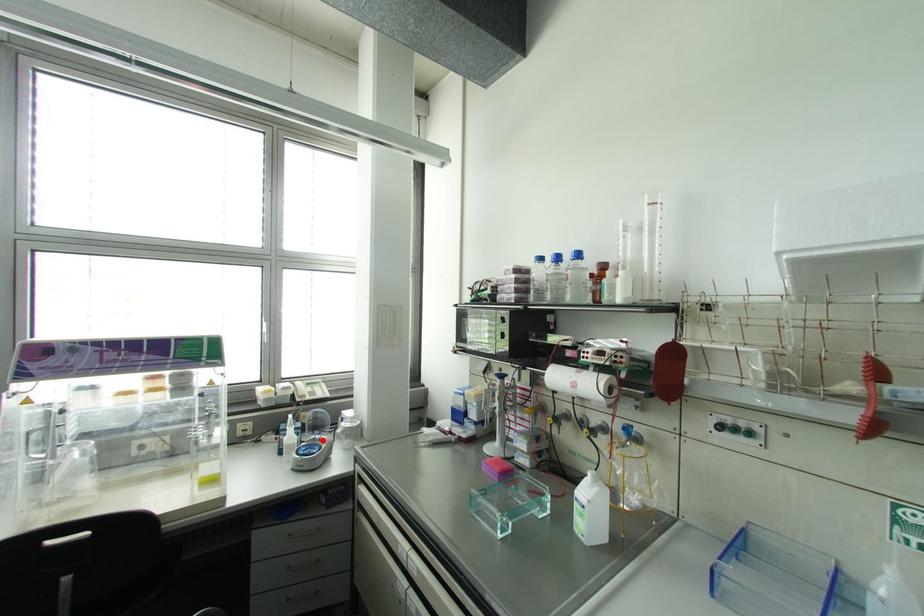
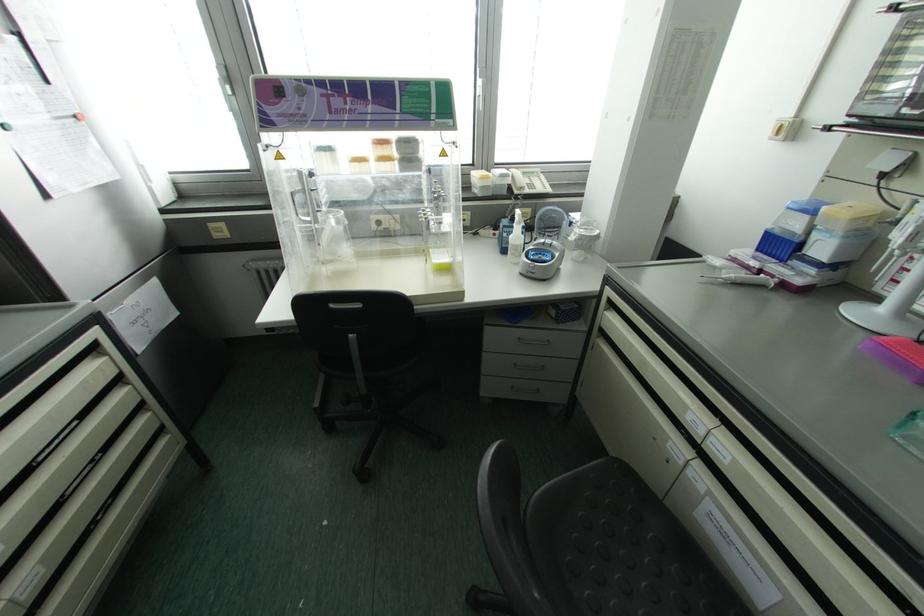
In the second image, find the point that corresponds to the highlighted location in the first image.

(553, 246)